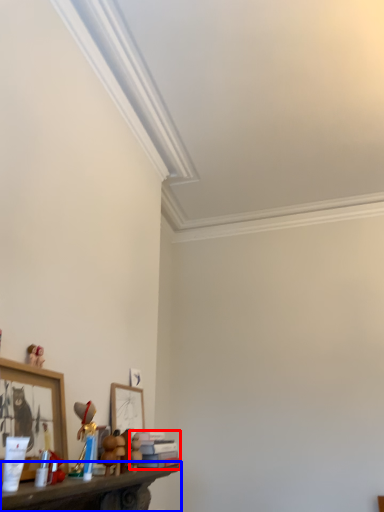
Question: Among these objects, which one is nearest to the camera, book (highlighted by a red box) or shelf (highlighted by a blue box)?

Choices:
 (A) book
 (B) shelf

Answer: (B)